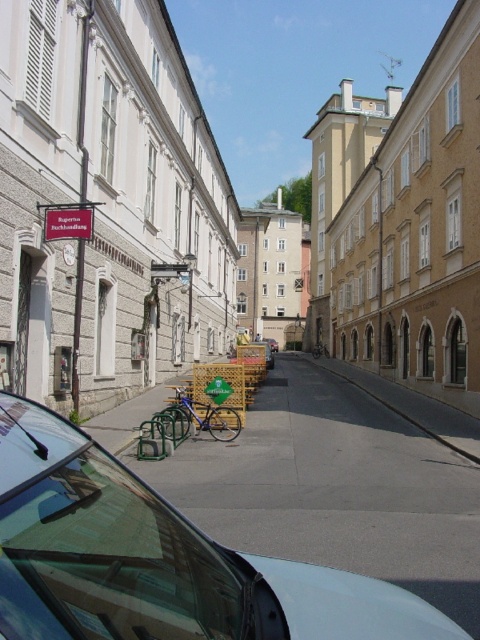
You are a delivery driver who needs to park your metallic silver car at center in a spot that is exactly at point (156, 557). Can you confirm if this parking spot is available?

The parking spot at point (156, 557) is occupied by a metallic silver car at center, so it is not available.

You are standing at the starting point of the street and want to reach the end of the street. There are two points marked on the map as point 1 at coordinates (407, 618) and point 2 at coordinates (361, 340). Which point should you head towards first to stay on the correct path?

Point 1 at coordinates (407, 618) is in front of point 2 at coordinates (361, 340), so you should head towards point 1 first to stay on the correct path.

You are a delivery driver who needs to park your metallic silver car at center in the narrow street. The brown textured building at right is on one side. Is there enough space between the car and the building to open the driver side door?

The metallic silver car at center has a smaller size compared to the brown textured building at right. Since the car is smaller, there should be sufficient space between them to open the driver side door without any issues.